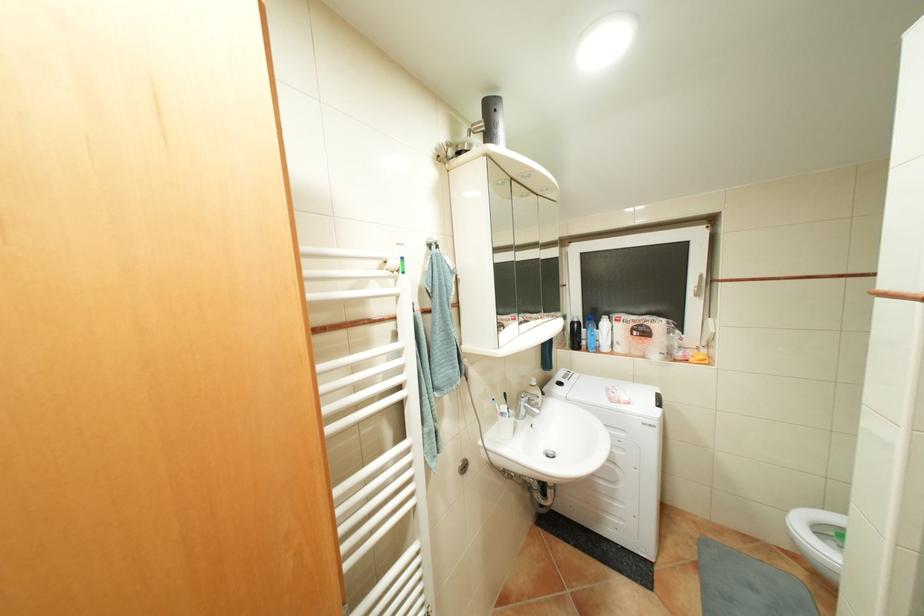
Which object does [604,334] point to?

It corresponds to the white plastic bottle in the image.